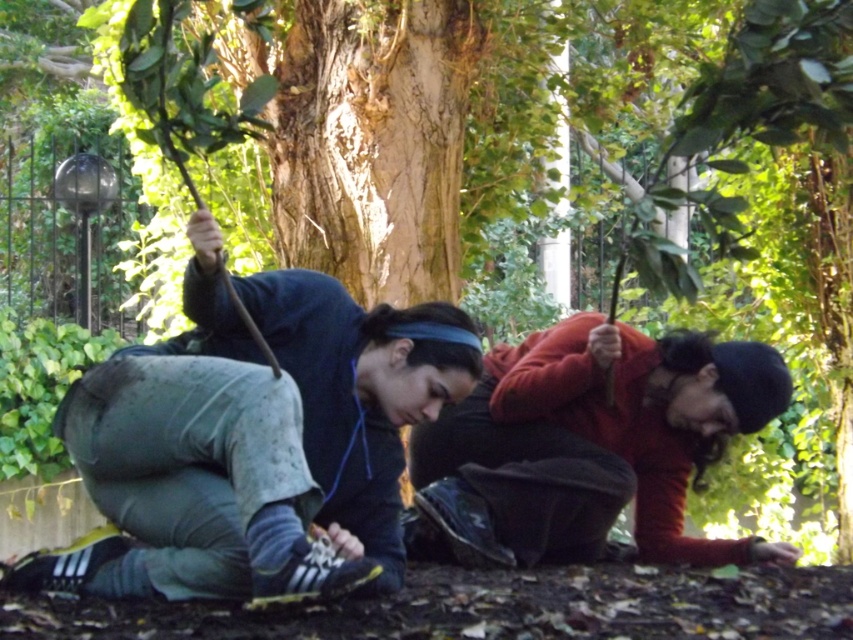
Between green camouflage pants at lower left and red sweater at lower right, which one is positioned higher?

green camouflage pants at lower left

Is green camouflage pants at lower left taller than red sweater at lower right?

Yes.

Who is more forward, (363, 456) or (529, 456)?

Positioned in front is point (363, 456).

At what (x,y) coordinates should I click in order to perform the action: click on green camouflage pants at lower left. Please return your answer as a coordinate pair (x, y). Looking at the image, I should click on (254, 440).